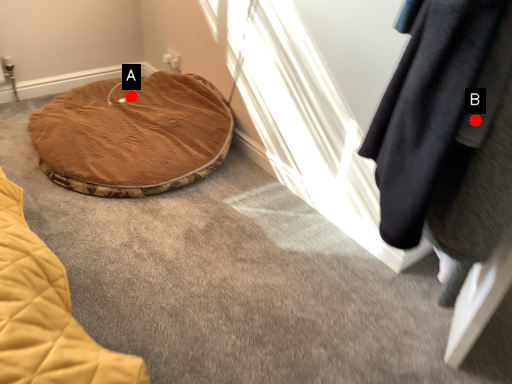
Question: Two points are circled on the image, labeled by A and B beside each circle. Among these points, which one is farthest from the camera?

Choices:
 (A) A is further
 (B) B is further

Answer: (A)